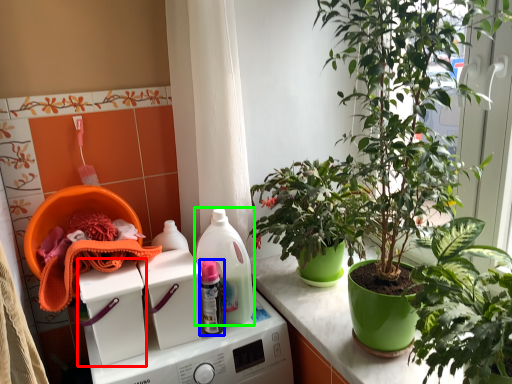
Question: Which object is the closest to the washing machine (highlighted by a red box)? Choose among these: bottle (highlighted by a blue box) or cleaning product (highlighted by a green box).

Choices:
 (A) bottle
 (B) cleaning product

Answer: (A)